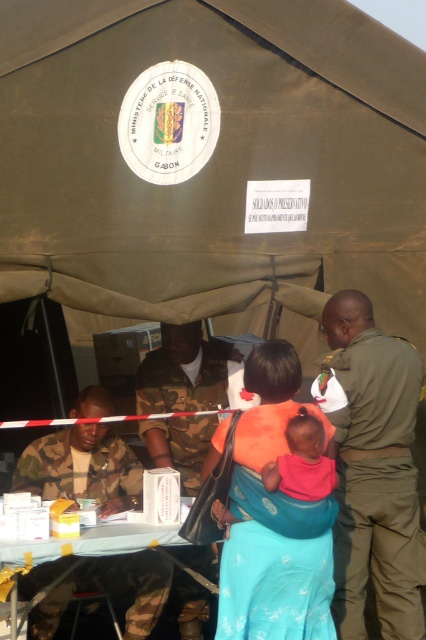
Who is positioned more to the left, orange fabric baby carrier at center or pink fabric baby at center?

orange fabric baby carrier at center

Does orange fabric baby carrier at center appear on the right side of pink fabric baby at center?

In fact, orange fabric baby carrier at center is to the left of pink fabric baby at center.

Identify the location of orange fabric baby carrier at center. (273, 518).

Which is behind, point (299, 534) or point (207, 445)?

The point (207, 445) is behind.

Does point (322, 531) come behind point (184, 378)?

That is False.

Locate an element on the screen. This screenshot has height=640, width=426. orange fabric baby carrier at center is located at coordinates (273, 518).

Between point (212, 397) and point (310, 444), which one is positioned in front?

Point (310, 444)

Between camo uniform at center and pink fabric baby at center, which one is positioned higher?

Positioned higher is camo uniform at center.

This screenshot has width=426, height=640. What do you see at coordinates (184, 371) in the screenshot? I see `camo uniform at center` at bounding box center [184, 371].

You are a GUI agent. You are given a task and a screenshot of the screen. Output one action in this format:
    pyautogui.click(x=<x>, y=<y>)
    Task: Click on the camo uniform at center
    The height and width of the screenshot is (640, 426).
    Given the screenshot: What is the action you would take?
    pyautogui.click(x=184, y=371)